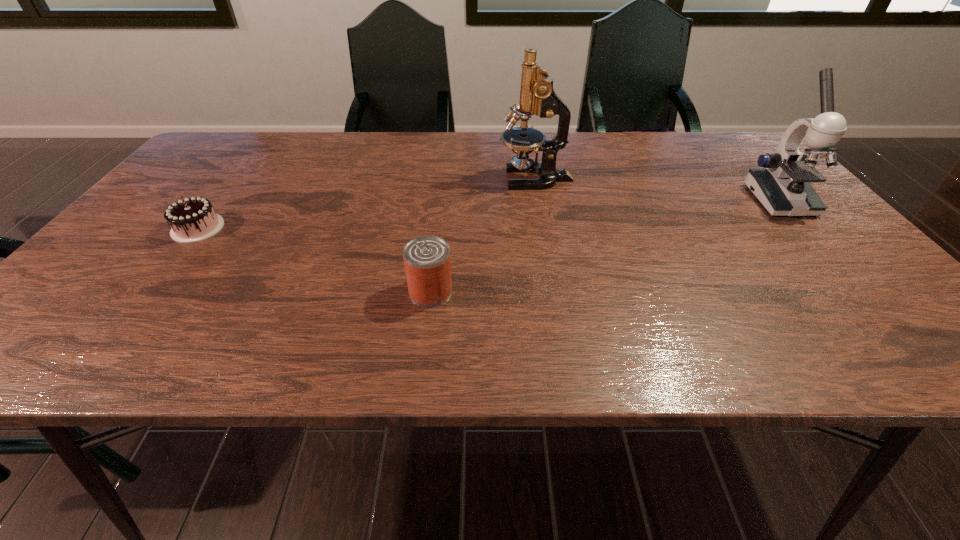
Identify the location of vacant area at the far right corner. This screenshot has height=540, width=960. (699, 137).

Identify the location of free spot between the rightmost object and the third tallest object. The image size is (960, 540). (605, 245).

Where is `free space between the left microscope and the leftmost object`? The width and height of the screenshot is (960, 540). free space between the left microscope and the leftmost object is located at coordinates (367, 203).

Identify the location of vacant point located between the second shortest object and the third object from left to right. coord(483,235).

This screenshot has height=540, width=960. In order to click on vacant point located between the third object from left to right and the rightmost object in this screenshot , I will do `click(658, 189)`.

Where is `unoccupied position between the nearest object and the shortest object`? The width and height of the screenshot is (960, 540). unoccupied position between the nearest object and the shortest object is located at coordinates (314, 259).

Locate an element on the screen. This screenshot has height=540, width=960. vacant space that is in between the second object from left to right and the rightmost object is located at coordinates (605, 245).

The height and width of the screenshot is (540, 960). In order to click on free area in between the right microscope and the can in this screenshot , I will do `click(605, 245)`.

Locate an element on the screen. Image resolution: width=960 pixels, height=540 pixels. free space between the can and the left microscope is located at coordinates (483, 235).

Where is `vacant area that lies between the left microscope and the chocolate cake`? vacant area that lies between the left microscope and the chocolate cake is located at coordinates (367, 203).